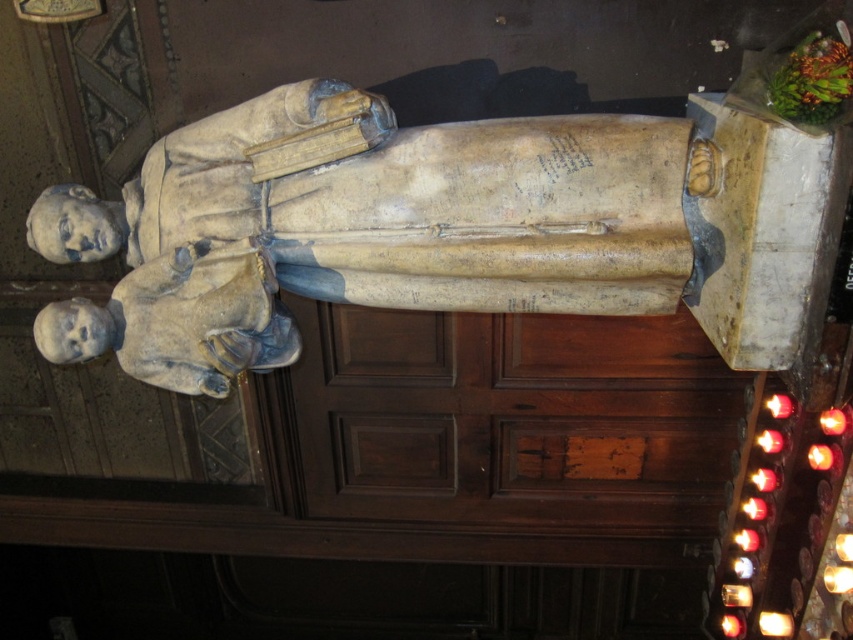
Question: Can you confirm if beige stone statue at center is wider than stone statue head at left?

Choices:
 (A) no
 (B) yes

Answer: (B)

Question: Does beige stone statue at center appear under stone statue head at left?

Choices:
 (A) yes
 (B) no

Answer: (B)

Question: Is beige stone statue at center thinner than stone statue head at left?

Choices:
 (A) yes
 (B) no

Answer: (B)

Question: Which of the following is the farthest from the observer?

Choices:
 (A) beige stone statue at center
 (B) stone statue head at left

Answer: (B)

Question: Among these points, which one is nearest to the camera?

Choices:
 (A) (135, 301)
 (B) (167, 323)

Answer: (B)

Question: Which of the following is the closest to the observer?

Choices:
 (A) (595, 234)
 (B) (293, 358)

Answer: (A)